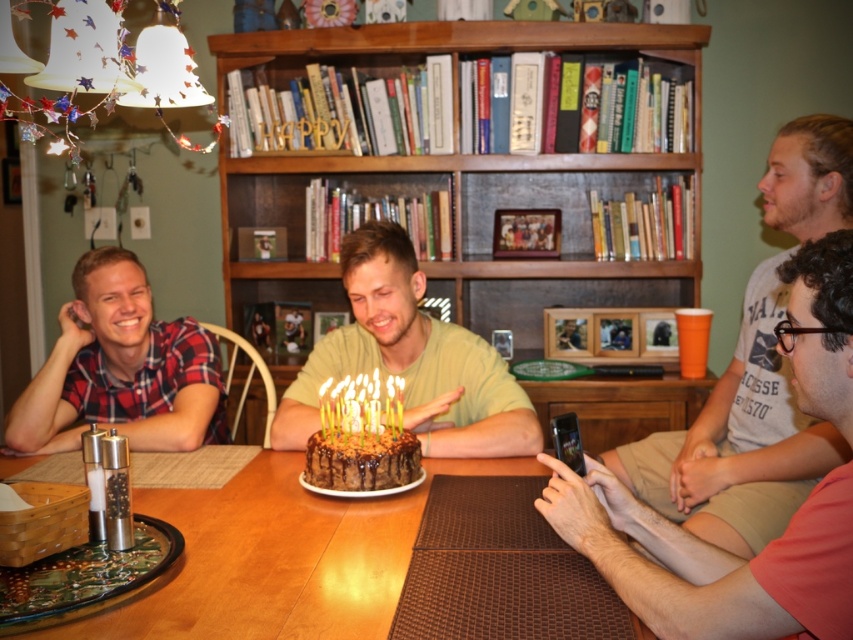
Question: Is wooden bookshelf at upper center above chocolate cake at center?

Choices:
 (A) yes
 (B) no

Answer: (A)

Question: Which point is farther to the camera?

Choices:
 (A) wooden bookshelf at upper center
 (B) brown textured placemat at center

Answer: (A)

Question: Can you confirm if wooden bookshelf at upper center is wider than chocolate frosted cake at center?

Choices:
 (A) no
 (B) yes

Answer: (B)

Question: Considering the real-world distances, which object is farthest from the wooden bookshelf at upper center?

Choices:
 (A) plaid fabric shirt at left
 (B) gray cotton t-shirt at center
 (C) brown textured placemat at center
 (D) chocolate frosted cake at center

Answer: (C)

Question: Which point is closer to the camera?

Choices:
 (A) [158, 360]
 (B) [502, 20]
 (C) [833, 212]
 (D) [224, 548]

Answer: (D)

Question: Does chocolate cake at center have a greater width compared to chocolate frosted cake at center?

Choices:
 (A) yes
 (B) no

Answer: (A)